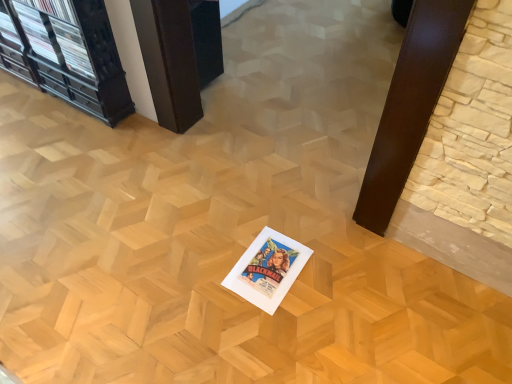
Question: Is wooden at center oriented away from white paper at center?

Choices:
 (A) no
 (B) yes

Answer: (A)

Question: Considering the relative sizes of wooden at center and white paper at center in the image provided, is wooden at center bigger than white paper at center?

Choices:
 (A) yes
 (B) no

Answer: (A)

Question: Can you confirm if wooden at center is thinner than white paper at center?

Choices:
 (A) no
 (B) yes

Answer: (A)

Question: From the image's perspective, is wooden at center on white paper at center?

Choices:
 (A) no
 (B) yes

Answer: (B)

Question: Is wooden at center further to camera compared to white paper at center?

Choices:
 (A) yes
 (B) no

Answer: (A)

Question: From a real-world perspective, is wooden at center beneath white paper at center?

Choices:
 (A) yes
 (B) no

Answer: (B)

Question: Would you consider white paper at center to be distant from wooden at center?

Choices:
 (A) no
 (B) yes

Answer: (A)

Question: Considering the relative sizes of white paper at center and wooden at center in the image provided, is white paper at center thinner than wooden at center?

Choices:
 (A) yes
 (B) no

Answer: (A)

Question: From a real-world perspective, is white paper at center under wooden at center?

Choices:
 (A) no
 (B) yes

Answer: (B)

Question: Is wooden at center surrounded by white paper at center?

Choices:
 (A) no
 (B) yes

Answer: (A)

Question: Is the surface of white paper at center in direct contact with wooden at center?

Choices:
 (A) yes
 (B) no

Answer: (B)

Question: Is white paper at center to the right of wooden at center from the viewer's perspective?

Choices:
 (A) yes
 (B) no

Answer: (A)

Question: Is wooden at center spatially inside white paper at center, or outside of it?

Choices:
 (A) inside
 (B) outside

Answer: (B)